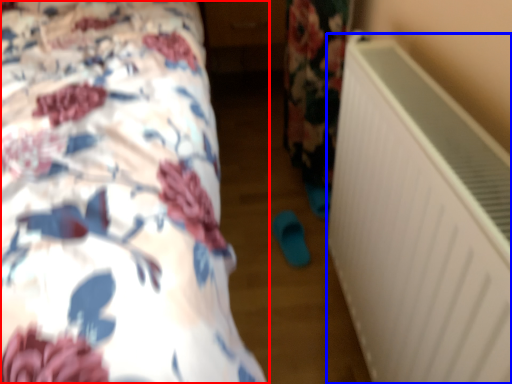
Question: Which of the following is the closest to the observer, bed (highlighted by a red box) or air conditioning (highlighted by a blue box)?

Choices:
 (A) bed
 (B) air conditioning

Answer: (A)